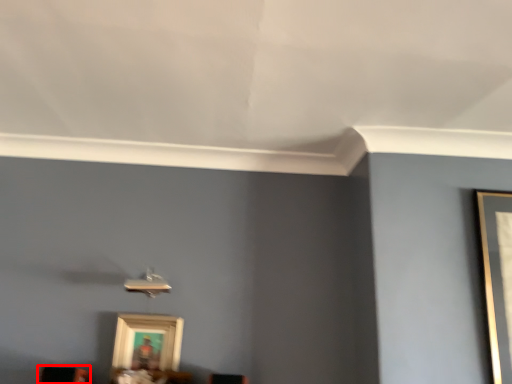
Question: From the image, what is the correct spatial relationship of furniture (annotated by the red box) in relation to picture frame?

Choices:
 (A) left
 (B) right

Answer: (A)